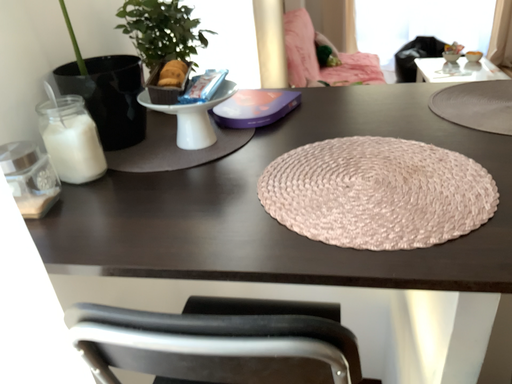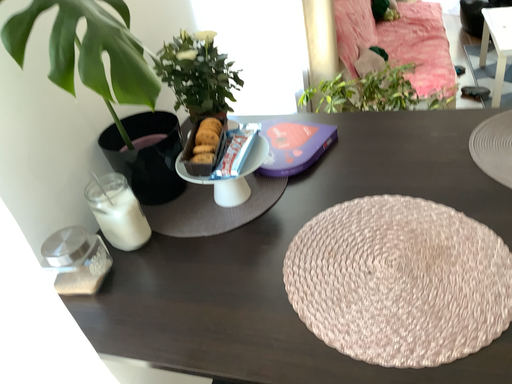
Question: How did the camera likely rotate when shooting the video?

Choices:
 (A) rotated downward
 (B) rotated upward

Answer: (A)